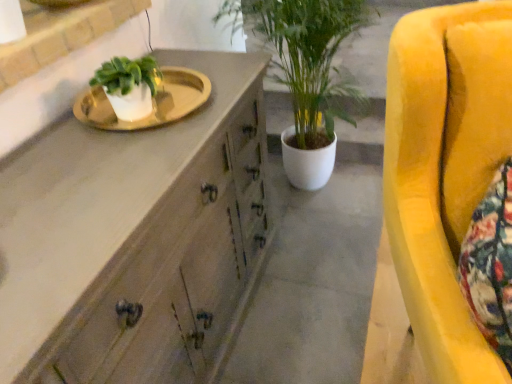
Where is `free space above concreteroughcabinet at center (from a real-world perspective)`? free space above concreteroughcabinet at center (from a real-world perspective) is located at coordinates (326, 283).